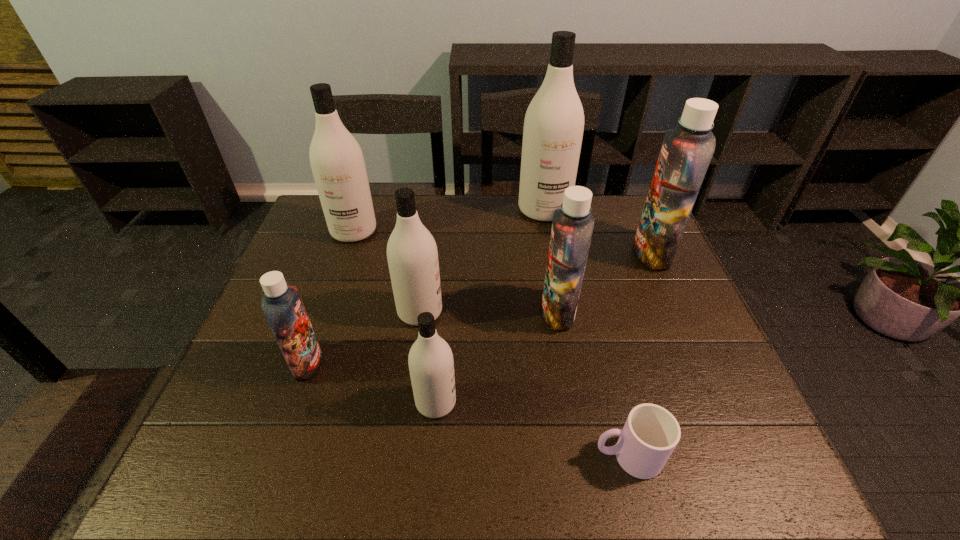
The width and height of the screenshot is (960, 540). Find the location of `blue shampoo that is the nearest to the third smallest white shampoo`. blue shampoo that is the nearest to the third smallest white shampoo is located at coordinates (282, 306).

The image size is (960, 540). Identify the location of the second closest blue shampoo relative to the smallest blue shampoo. (686, 152).

This screenshot has width=960, height=540. Find the location of `vacant space that satisfies the following two spatial constraints: 1. with the handle on the side of the cup; 2. on the front label of the second biggest blue shampoo`. vacant space that satisfies the following two spatial constraints: 1. with the handle on the side of the cup; 2. on the front label of the second biggest blue shampoo is located at coordinates (591, 312).

Locate an element on the screen. Image resolution: width=960 pixels, height=540 pixels. free point that satisfies the following two spatial constraints: 1. on the front-facing side of the tallest shampoo; 2. on the front label of the smallest blue shampoo is located at coordinates (572, 363).

Identify the location of vacant space that satisfies the following two spatial constraints: 1. on the front-facing side of the rightmost white shampoo; 2. on the front label of the leftmost blue shampoo. Image resolution: width=960 pixels, height=540 pixels. (572, 363).

You are a GUI agent. You are given a task and a screenshot of the screen. Output one action in this format:
    pyautogui.click(x=<x>, y=<y>)
    Task: Click on the free space that satisfies the following two spatial constraints: 1. with the handle on the side of the nearest object; 2. on the front label of the smallest blue shampoo
    The image size is (960, 540).
    Given the screenshot: What is the action you would take?
    pyautogui.click(x=604, y=363)

In order to click on vacant point that satisfies the following two spatial constraints: 1. on the front label of the second nearest blue shampoo; 2. with the handle on the side of the nearest object in this screenshot , I will do `click(583, 456)`.

Find the location of a particular element. The image size is (960, 540). free space that satisfies the following two spatial constraints: 1. with the handle on the side of the cup; 2. on the front-facing side of the smallest white shampoo is located at coordinates (614, 402).

Find the location of `blank space that satisfies the following two spatial constraints: 1. with the handle on the side of the nearest object; 2. on the front label of the leftmost blue shampoo`. blank space that satisfies the following two spatial constraints: 1. with the handle on the side of the nearest object; 2. on the front label of the leftmost blue shampoo is located at coordinates (604, 363).

Locate an element on the screen. This screenshot has height=540, width=960. blank space that satisfies the following two spatial constraints: 1. with the handle on the side of the cup; 2. on the front-facing side of the smallest white shampoo is located at coordinates (614, 402).